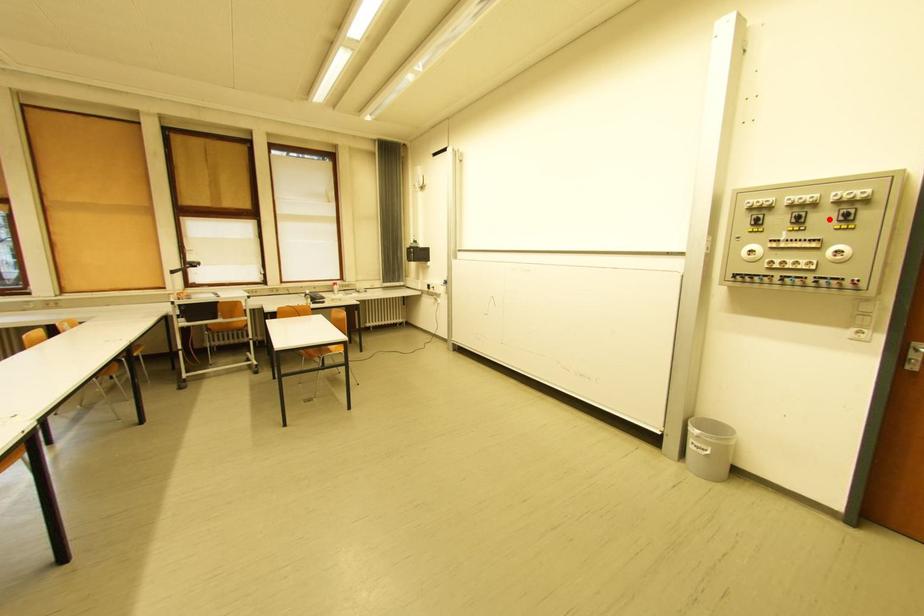
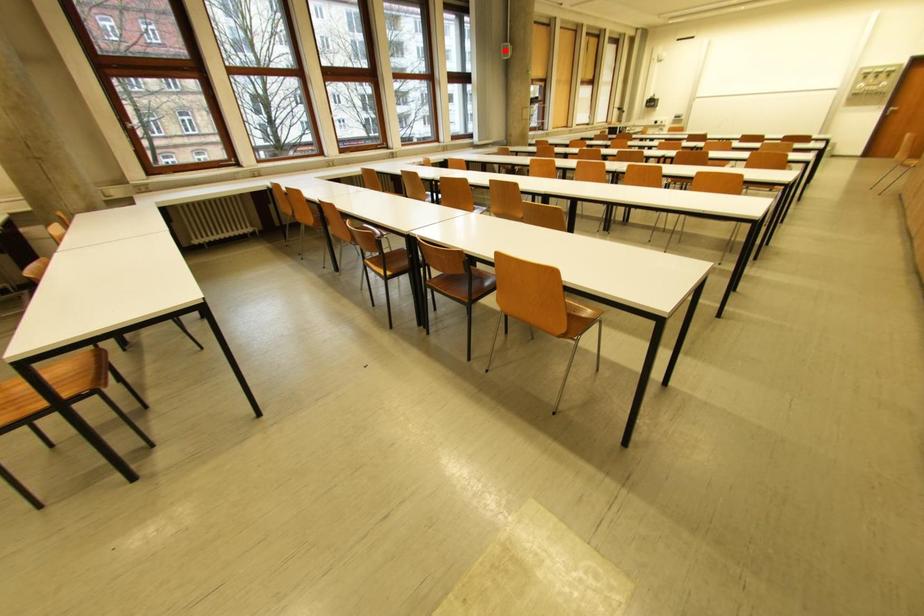
I am providing you with two images of the same scene from different viewpoints. A red point is marked on the first image and another point is marked on the second image. Is the marked point in image1 the same physical position as the marked point in image2?

No